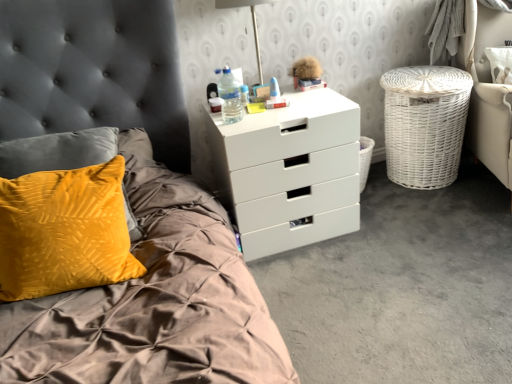
Question: From the image's perspective, is white wicker armchair at right located beneath translucent plastic water bottle at upper right?

Choices:
 (A) yes
 (B) no

Answer: (B)

Question: Can you confirm if white wicker armchair at right is shorter than translucent plastic water bottle at upper right?

Choices:
 (A) no
 (B) yes

Answer: (A)

Question: Would you say white wicker armchair at right is a long distance from translucent plastic water bottle at upper right?

Choices:
 (A) no
 (B) yes

Answer: (B)

Question: Can you confirm if white wicker armchair at right is smaller than translucent plastic water bottle at upper right?

Choices:
 (A) no
 (B) yes

Answer: (A)

Question: Is white wicker armchair at right at the left side of translucent plastic water bottle at upper right?

Choices:
 (A) no
 (B) yes

Answer: (A)

Question: Could you tell me if white wicker armchair at right is turned towards translucent plastic water bottle at upper right?

Choices:
 (A) no
 (B) yes

Answer: (A)

Question: Is white wicker armchair at right turned away from white wicker laundry basket at right?

Choices:
 (A) no
 (B) yes

Answer: (A)

Question: From the image's perspective, is white wicker armchair at right beneath white wicker laundry basket at right?

Choices:
 (A) no
 (B) yes

Answer: (A)

Question: Is white wicker armchair at right located outside white wicker laundry basket at right?

Choices:
 (A) no
 (B) yes

Answer: (B)

Question: From the image's perspective, does white wicker armchair at right appear higher than white wicker laundry basket at right?

Choices:
 (A) no
 (B) yes

Answer: (B)

Question: Does white wicker armchair at right have a greater height compared to white wicker laundry basket at right?

Choices:
 (A) no
 (B) yes

Answer: (B)

Question: Does white wicker armchair at right have a larger size compared to white wicker laundry basket at right?

Choices:
 (A) yes
 (B) no

Answer: (A)

Question: Can you confirm if translucent plastic water bottle at upper right is thinner than white plastic chest of drawers at upper center?

Choices:
 (A) yes
 (B) no

Answer: (A)